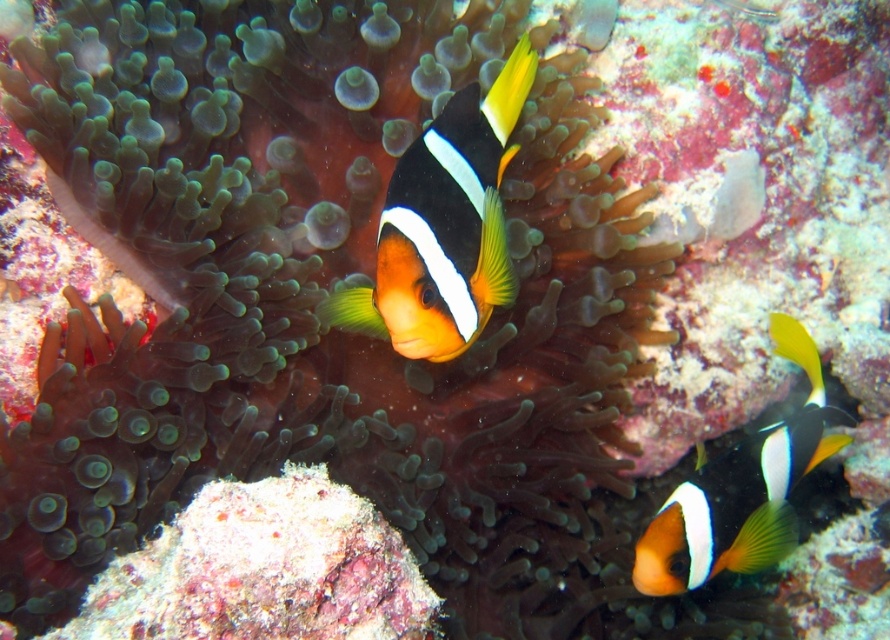
Question: Which point is farther from the camera taking this photo?

Choices:
 (A) (697, 499)
 (B) (473, 200)

Answer: (A)

Question: Does orange matte clownfish at center appear over orange and white clownfish at lower right?

Choices:
 (A) no
 (B) yes

Answer: (B)

Question: Is orange matte clownfish at center further to the viewer compared to orange and white clownfish at lower right?

Choices:
 (A) yes
 (B) no

Answer: (B)

Question: From the image, what is the correct spatial relationship of orange matte clownfish at center in relation to orange and white clownfish at lower right?

Choices:
 (A) above
 (B) below

Answer: (A)

Question: Which point is closer to the camera?

Choices:
 (A) (714, 490)
 (B) (426, 192)

Answer: (B)

Question: Which point appears farthest from the camera in this image?

Choices:
 (A) (678, 561)
 (B) (456, 195)

Answer: (A)